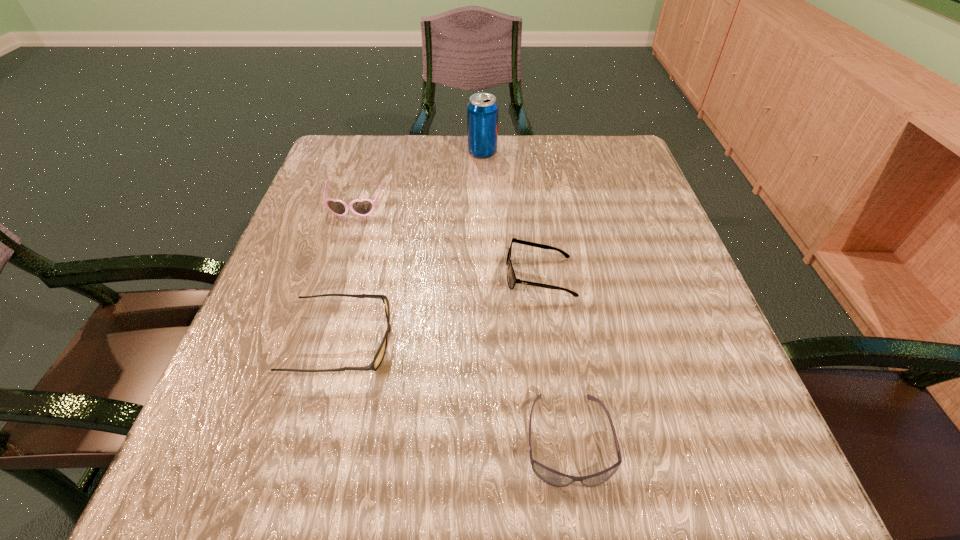
This screenshot has height=540, width=960. In the image, there is a desktop. What are the coordinates of `vacant space at the far right corner` in the screenshot? It's located at (594, 188).

Identify the location of free area in between the third farthest object and the farthest sunglasses. (447, 241).

Where is `free spot between the third farthest sunglasses and the nearest object`? The height and width of the screenshot is (540, 960). free spot between the third farthest sunglasses and the nearest object is located at coordinates (455, 390).

This screenshot has height=540, width=960. Identify the location of unoccupied position between the nearest sunglasses and the farthest sunglasses. (462, 323).

Find the location of a particular element. Image resolution: width=960 pixels, height=540 pixels. unoccupied area between the fourth nearest object and the third farthest sunglasses is located at coordinates (348, 274).

Identify the location of vacant area that lies between the third nearest object and the third object from right to left. Image resolution: width=960 pixels, height=540 pixels. (512, 214).

The width and height of the screenshot is (960, 540). I want to click on blank region between the farthest sunglasses and the nearest object, so click(x=462, y=323).

I want to click on free space between the nearest sunglasses and the third farthest object, so click(554, 357).

The image size is (960, 540). I want to click on blank region between the second farthest sunglasses and the nearest sunglasses, so (554, 357).

Locate an element on the screen. The height and width of the screenshot is (540, 960). vacant space in between the fourth nearest object and the pop soda is located at coordinates (419, 180).